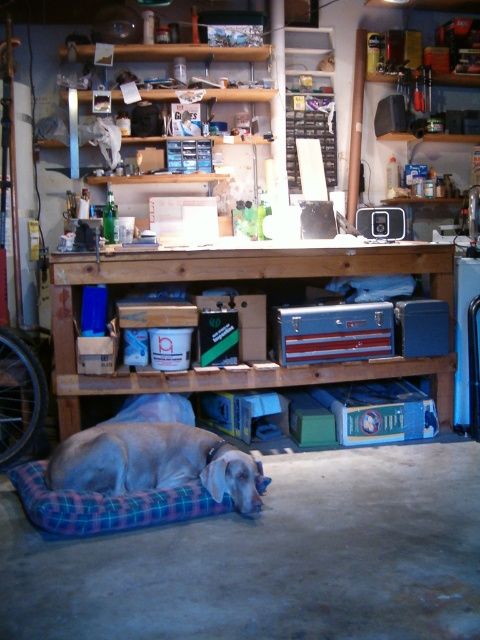
Question: Does metallic silver toolbox at center have a smaller size compared to plaid fabric dog bed at lower center?

Choices:
 (A) yes
 (B) no

Answer: (B)

Question: Which is nearer to the metallic silver toolbox at center?

Choices:
 (A) gray fabric dog bed at lower left
 (B) plaid fabric dog bed at lower center

Answer: (A)

Question: Which object is the farthest from the metallic silver toolbox at center?

Choices:
 (A) gray fabric dog bed at lower left
 (B) plaid fabric dog bed at lower center

Answer: (B)

Question: Is metallic silver toolbox at center positioned behind gray fabric dog bed at lower left?

Choices:
 (A) no
 (B) yes

Answer: (B)

Question: Does metallic silver toolbox at center have a lesser width compared to gray fabric dog bed at lower left?

Choices:
 (A) no
 (B) yes

Answer: (A)

Question: Which of the following is the farthest from the observer?

Choices:
 (A) plaid fabric dog bed at lower center
 (B) gray fabric dog bed at lower left

Answer: (B)